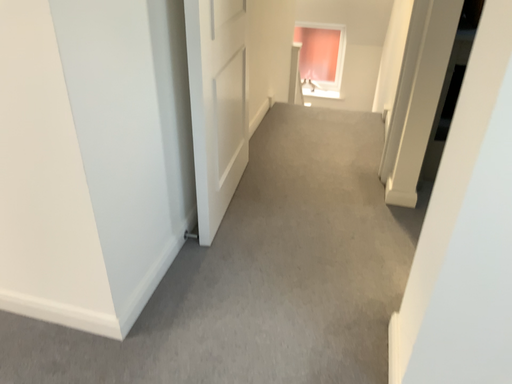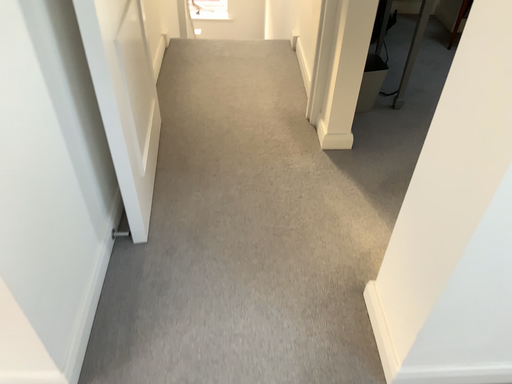
Question: How did the camera likely rotate when shooting the video?

Choices:
 (A) rotated downward
 (B) rotated upward

Answer: (A)